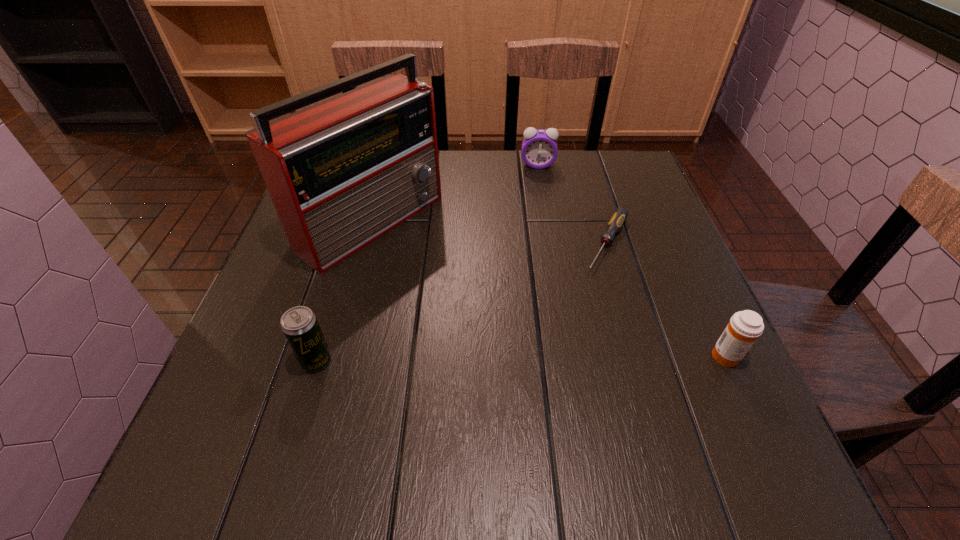
Where is `vacant space positioned 0.150m insert the screwdriver into a screw head`? vacant space positioned 0.150m insert the screwdriver into a screw head is located at coordinates (576, 316).

Where is `vacant space located 0.100m insert the screwdriver into a screw head`? This screenshot has height=540, width=960. vacant space located 0.100m insert the screwdriver into a screw head is located at coordinates tap(586, 300).

I want to click on free spot located 0.310m on the face of the alarm clock, so click(x=540, y=244).

This screenshot has width=960, height=540. Find the location of `vacant space situated 0.390m on the face of the alarm clock`. vacant space situated 0.390m on the face of the alarm clock is located at coordinates (540, 268).

At what (x,y) coordinates should I click in order to perform the action: click on free space located 0.330m on the face of the alarm clock. Please return your answer as a coordinate pair (x, y). Looking at the image, I should click on (540, 249).

Find the location of `vacant space located on the front-facing side of the radio receiver`. vacant space located on the front-facing side of the radio receiver is located at coordinates (443, 272).

Find the location of `free space located 0.140m on the front-facing side of the radio receiver`. free space located 0.140m on the front-facing side of the radio receiver is located at coordinates (463, 285).

What are the coordinates of `vacant space located 0.180m on the front-facing side of the radio receiver` in the screenshot? It's located at (477, 294).

The height and width of the screenshot is (540, 960). I want to click on alarm clock that is at the far edge, so click(x=539, y=147).

Identify the location of radio receiver present at the far edge. This screenshot has width=960, height=540. (341, 173).